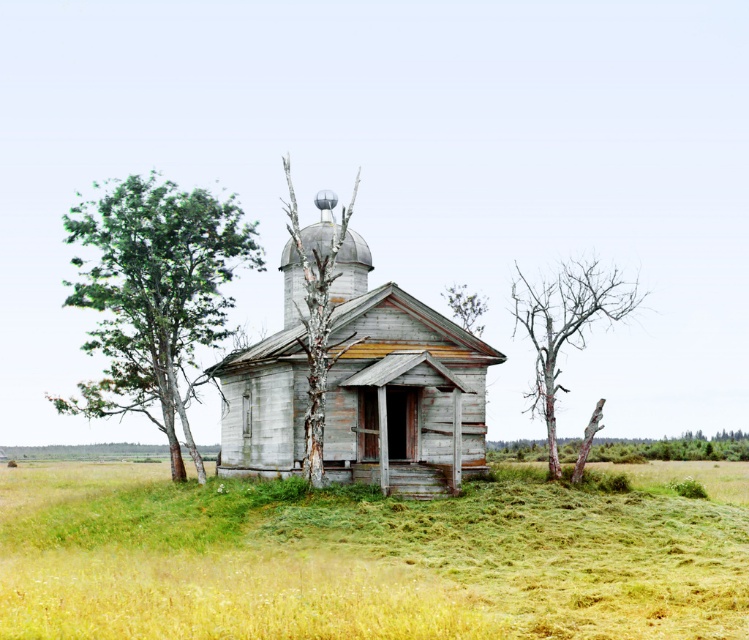
The height and width of the screenshot is (640, 749). Describe the element at coordinates (369, 556) in the screenshot. I see `green grassy field at center` at that location.

Does green grassy field at center appear over weathered wood church at center?

Incorrect, green grassy field at center is not positioned above weathered wood church at center.

Is point (1, 490) closer to viewer compared to point (428, 320)?

No, (1, 490) is behind (428, 320).

Locate an element on the screen. Image resolution: width=749 pixels, height=640 pixels. green grassy field at center is located at coordinates (369, 556).

Based on the photo, does green grassy field at center lie in front of bare wood tree at right?

Yes.

Is green grassy field at center positioned behind bare wood tree at right?

No.

Measure the distance between point (187, 624) and camera.

Point (187, 624) is 12.42 meters from camera.

This screenshot has height=640, width=749. I want to click on green grassy field at center, so click(x=369, y=556).

This screenshot has height=640, width=749. Identify the location of weathered wood church at center. (351, 376).

Between point (409, 401) and point (209, 243), which one is positioned behind?

Positioned behind is point (209, 243).

Find the location of a particular element. The image size is (749, 640). weathered wood church at center is located at coordinates (351, 376).

Where is `weathered wood church at center`? Image resolution: width=749 pixels, height=640 pixels. weathered wood church at center is located at coordinates (351, 376).